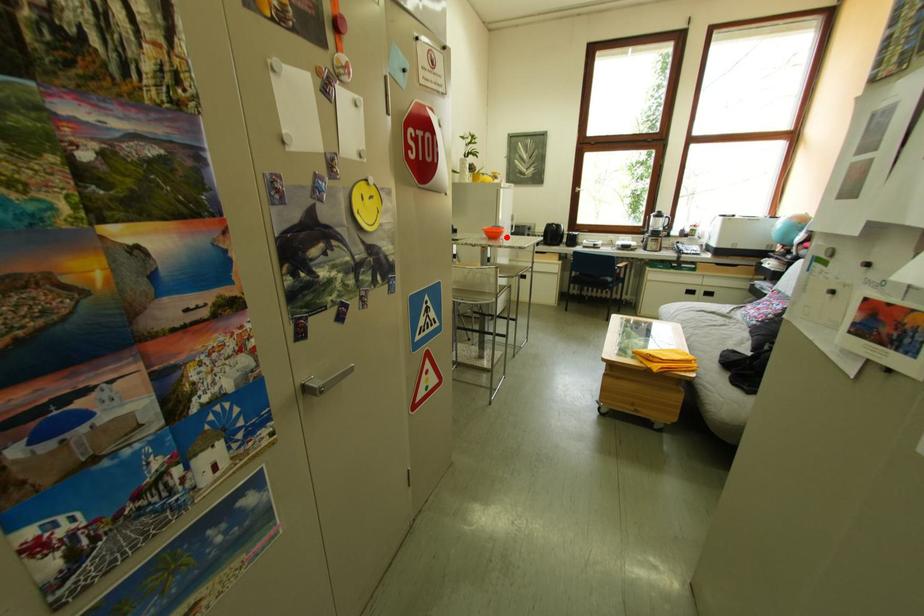
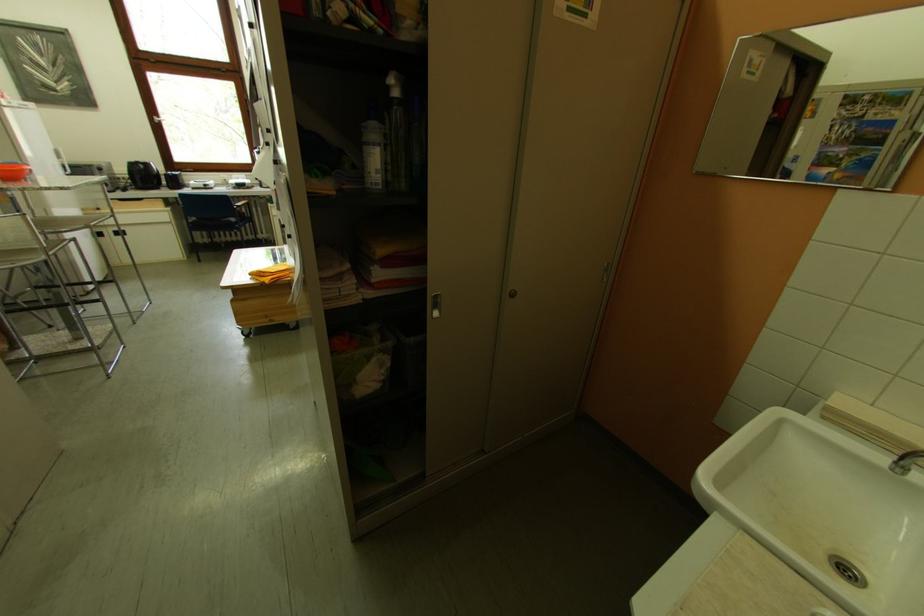
Locate, in the second image, the point that corresponds to the highlighted location in the first image.

(23, 177)